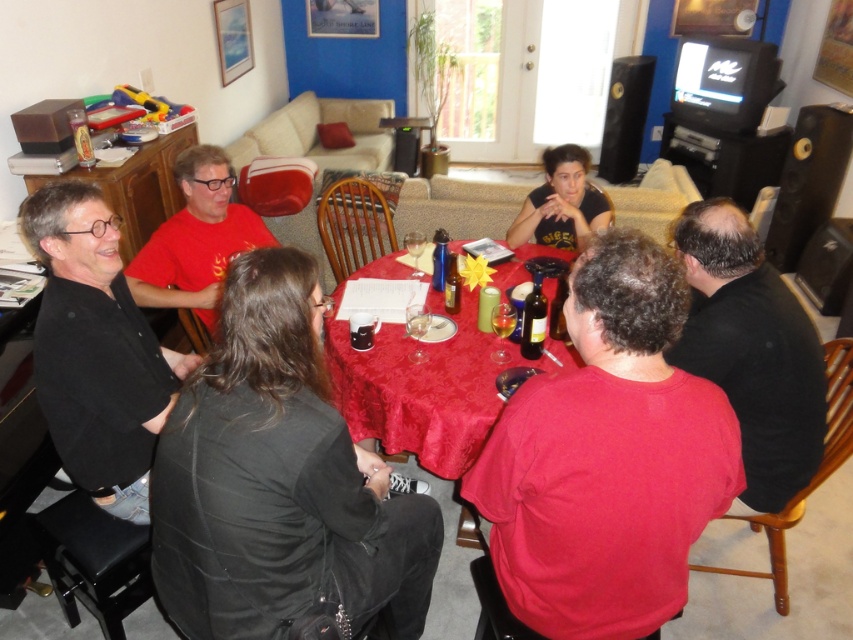
Between point (286, 486) and point (140, 296), which one is positioned behind?

Point (140, 296)

Can you confirm if black matte jacket at lower left is positioned to the right of matte red shirt at center?

Indeed, black matte jacket at lower left is positioned on the right side of matte red shirt at center.

What do you see at coordinates (277, 481) in the screenshot? The height and width of the screenshot is (640, 853). I see `black matte jacket at lower left` at bounding box center [277, 481].

Find the location of a particular element. The image size is (853, 640). black matte jacket at lower left is located at coordinates (277, 481).

Between red satin tablecloth at center and translucent glass at table center, which one has less height?

translucent glass at table center

Does red satin tablecloth at center have a greater height compared to translucent glass at table center?

Yes, red satin tablecloth at center is taller than translucent glass at table center.

Who is more forward, (341, 368) or (428, 323)?

Point (341, 368) is in front.

Where is `red satin tablecloth at center`? Image resolution: width=853 pixels, height=640 pixels. red satin tablecloth at center is located at coordinates (425, 388).

Between black matte shirt at upper center and dark glass bottle at center, which one is positioned higher?

Positioned higher is black matte shirt at upper center.

Which is behind, point (529, 196) or point (538, 272)?

Point (529, 196)

Between point (582, 184) and point (537, 291), which one is positioned in front?

Positioned in front is point (537, 291).

Identify the location of black matte shirt at upper center. (561, 202).